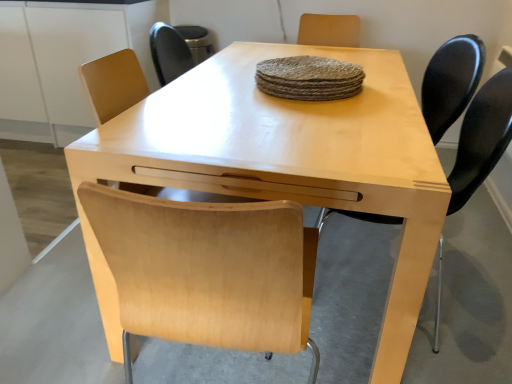
Measure the distance between light wood table at center and camera.

light wood table at center and camera are 1.28 meters apart.

Describe the element at coordinates (451, 82) in the screenshot. I see `matte black chair at right, the first chair when ordered from back to front` at that location.

Where is `light wood table at center`? The image size is (512, 384). light wood table at center is located at coordinates (292, 157).

This screenshot has height=384, width=512. Describe the element at coordinates (482, 138) in the screenshot. I see `matte black chair at right, the 1th chair positioned from the front` at that location.

Where is `light wood table at center`? light wood table at center is located at coordinates (468, 303).

Considering the sizes of light wood table at center and matte black chair at right, the first chair when ordered from back to front, in the image, is light wood table at center wider or thinner than matte black chair at right, the first chair when ordered from back to front,?

light wood table at center is wider than matte black chair at right, the first chair when ordered from back to front.

From a real-world perspective, is light wood table at center positioned above or below matte black chair at right, the 2th chair viewed from the front?

In terms of real-world spatial position, light wood table at center is below matte black chair at right, the 2th chair viewed from the front.

Is light wood table at center turned away from matte black chair at right, the 2th chair viewed from the front?

Correct, light wood table at center is looking away from matte black chair at right, the 2th chair viewed from the front.

Considering the positions of point (395, 358) and point (445, 69), is point (395, 358) closer or farther from the camera than point (445, 69)?

Point (395, 358) is positioned closer to the camera compared to point (445, 69).

Can you confirm if light wood table at center is positioned to the right of matte black chair at right, the 1th chair positioned from the front?

In fact, light wood table at center is to the left of matte black chair at right, the 1th chair positioned from the front.

Are light wood table at center and matte black chair at right, positioned as the 2th chair in back-to-front order, making contact?

light wood table at center and matte black chair at right, positioned as the 2th chair in back-to-front order, are not in contact.

Consider the image. Can you tell me how much light wood table at center and matte black chair at right, positioned as the 2th chair in back-to-front order, differ in facing direction?

They differ by 92.1 degrees in their facing directions.

From a real-world perspective, is light wood table at center positioned above or below matte black chair at right, positioned as the 2th chair in back-to-front order?

Clearly, from a real-world perspective, light wood table at center is below matte black chair at right, positioned as the 2th chair in back-to-front order.

Which of these two, light wood table at center or light wood table at center, is bigger?

light wood table at center.

Is light wood table at center aimed at light wood table at center?

Yes, light wood table at center is oriented towards light wood table at center.

Is point (421, 123) less distant than point (461, 234)?

Yes.

Which is more to the left, light wood table at center or light wood table at center?

From the viewer's perspective, light wood table at center appears more on the left side.

From the image's perspective, is light wood table at center under matte black chair at right, the 2th chair viewed from the front?

Yes, from the image's perspective, light wood table at center is below matte black chair at right, the 2th chair viewed from the front.

Who is more distant, light wood table at center or matte black chair at right, the 2th chair viewed from the front?

matte black chair at right, the 2th chair viewed from the front, is behind.

Does light wood table at center have a lesser height compared to matte black chair at right, the 2th chair viewed from the front?

Indeed, light wood table at center has a lesser height compared to matte black chair at right, the 2th chair viewed from the front.

Is matte black chair at right, the first chair when ordered from back to front, located within light wood table at center?

No, matte black chair at right, the first chair when ordered from back to front, is not inside light wood table at center.

Is matte black chair at right, positioned as the 2th chair in back-to-front order, closer to the viewer compared to matte black chair at right, the first chair when ordered from back to front?

Yes, matte black chair at right, positioned as the 2th chair in back-to-front order, is closer to the camera.

From the image's perspective, relative to matte black chair at right, the first chair when ordered from back to front, is matte black chair at right, positioned as the 2th chair in back-to-front order, above or below?

From the image's perspective, matte black chair at right, positioned as the 2th chair in back-to-front order, appears below matte black chair at right, the first chair when ordered from back to front.

Is matte black chair at right, positioned as the 2th chair in back-to-front order, thinner than matte black chair at right, the first chair when ordered from back to front?

Indeed, matte black chair at right, positioned as the 2th chair in back-to-front order, has a lesser width compared to matte black chair at right, the first chair when ordered from back to front.

Does matte black chair at right, the 2th chair viewed from the front, turn towards light wood table at center?

Yes, matte black chair at right, the 2th chair viewed from the front, is facing light wood table at center.

Considering the relative sizes of matte black chair at right, the 2th chair viewed from the front, and light wood table at center in the image provided, is matte black chair at right, the 2th chair viewed from the front, shorter than light wood table at center?

Incorrect, the height of matte black chair at right, the 2th chair viewed from the front, does not fall short of that of light wood table at center.

Which object is wider, matte black chair at right, the 2th chair viewed from the front, or light wood table at center?

light wood table at center is wider.

How far apart are matte black chair at right, the first chair when ordered from back to front, and light wood table at center?

A distance of 33.97 inches exists between matte black chair at right, the first chair when ordered from back to front, and light wood table at center.

Does point (383, 217) lie behind point (69, 253)?

No, it is not.

In the scene shown: Is matte black chair at right, positioned as the 2th chair in back-to-front order, oriented towards light wood table at center?

Yes, matte black chair at right, positioned as the 2th chair in back-to-front order, is turned towards light wood table at center.

Which is in front, matte black chair at right, the 1th chair positioned from the front, or light wood table at center?

light wood table at center.

This screenshot has height=384, width=512. What are the coordinates of `chair above the light wood table at center (from the image's perspective)` in the screenshot? It's located at (451, 82).

This screenshot has height=384, width=512. I want to click on concrete that is under the matte black chair at right, the 1th chair positioned from the front (from a real-world perspective), so click(x=468, y=303).

Which object lies further to the anchor point matte black chair at right, the first chair when ordered from back to front, light wood table at center or matte black chair at right, positioned as the 2th chair in back-to-front order?

light wood table at center.

From the image, which object appears to be nearer to matte black chair at right, the first chair when ordered from back to front, matte black chair at right, the 1th chair positioned from the front, or light wood table at center?

matte black chair at right, the 1th chair positioned from the front.

From the image, which object appears to be farther from light wood table at center, light wood table at center or matte black chair at right, the first chair when ordered from back to front?

matte black chair at right, the first chair when ordered from back to front, is positioned further to the anchor light wood table at center.

Based on their spatial positions, is light wood table at center or matte black chair at right, the 1th chair positioned from the front, closer to matte black chair at right, the 2th chair viewed from the front?

matte black chair at right, the 1th chair positioned from the front, is closer to matte black chair at right, the 2th chair viewed from the front.

Which object lies further to the anchor point matte black chair at right, the 1th chair positioned from the front, light wood table at center or matte black chair at right, the 2th chair viewed from the front?

light wood table at center lies further to matte black chair at right, the 1th chair positioned from the front, than the other object.

Based on their spatial positions, is matte black chair at right, the 2th chair viewed from the front, or light wood table at center further from matte black chair at right, the 1th chair positioned from the front?

light wood table at center lies further to matte black chair at right, the 1th chair positioned from the front, than the other object.

Considering their positions, is light wood table at center positioned further to light wood table at center than matte black chair at right, the 1th chair positioned from the front?

Among the two, light wood table at center is located further to light wood table at center.

Considering their positions, is light wood table at center positioned further to matte black chair at right, the first chair when ordered from back to front, than light wood table at center?

light wood table at center lies further to matte black chair at right, the first chair when ordered from back to front, than the other object.

This screenshot has width=512, height=384. Identify the location of chair between light wood table at center and matte black chair at right, the first chair when ordered from back to front, from front to back. (482, 138).

I want to click on table situated between light wood table at center and matte black chair at right, positioned as the 2th chair in back-to-front order, from left to right, so point(292,157).

Identify the location of chair situated between light wood table at center and matte black chair at right, the 2th chair viewed from the front, from left to right. The width and height of the screenshot is (512, 384). (482, 138).

This screenshot has width=512, height=384. Find the location of `table located between light wood table at center and matte black chair at right, the first chair when ordered from back to front, in the left-right direction`. table located between light wood table at center and matte black chair at right, the first chair when ordered from back to front, in the left-right direction is located at coordinates (292, 157).